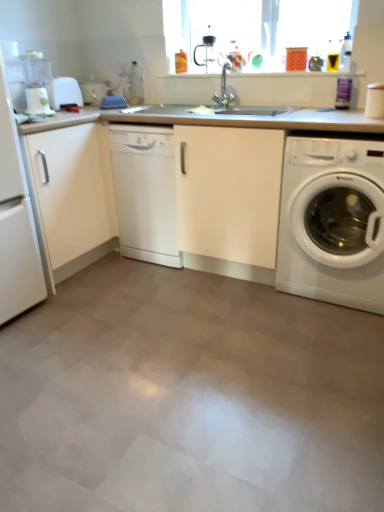
Question: Is matte white toaster at upper left, the first appliance positioned from the back, bigger than white glossy dishwasher at center?

Choices:
 (A) no
 (B) yes

Answer: (A)

Question: Is matte white toaster at upper left, the first appliance positioned from the back, aimed at white glossy dishwasher at center?

Choices:
 (A) yes
 (B) no

Answer: (B)

Question: Can you confirm if matte white toaster at upper left, the first appliance positioned from the back, is positioned to the left of white glossy dishwasher at center?

Choices:
 (A) yes
 (B) no

Answer: (A)

Question: Is matte white toaster at upper left, the first appliance positioned from the back, facing away from white glossy dishwasher at center?

Choices:
 (A) no
 (B) yes

Answer: (A)

Question: From the image's perspective, is matte white toaster at upper left, the first appliance positioned from the back, located beneath white glossy dishwasher at center?

Choices:
 (A) yes
 (B) no

Answer: (B)

Question: Is there a large distance between matte white toaster at upper left, the first appliance positioned from the back, and white glossy dishwasher at center?

Choices:
 (A) yes
 (B) no

Answer: (B)

Question: Considering the relative sizes of matte white toaster at upper left, placed as the second appliance when sorted from front to back, and white plastic coffee machine at left in the image provided, is matte white toaster at upper left, placed as the second appliance when sorted from front to back, wider than white plastic coffee machine at left?

Choices:
 (A) no
 (B) yes

Answer: (B)

Question: Is matte white toaster at upper left, placed as the second appliance when sorted from front to back, outside white plastic coffee machine at left?

Choices:
 (A) yes
 (B) no

Answer: (A)

Question: Is matte white toaster at upper left, the first appliance positioned from the back, taller than white plastic coffee machine at left?

Choices:
 (A) yes
 (B) no

Answer: (B)

Question: Considering the relative sizes of matte white toaster at upper left, the first appliance positioned from the back, and white plastic coffee machine at left in the image provided, is matte white toaster at upper left, the first appliance positioned from the back, smaller than white plastic coffee machine at left?

Choices:
 (A) yes
 (B) no

Answer: (B)

Question: Are matte white toaster at upper left, placed as the second appliance when sorted from front to back, and white plastic coffee machine at left making contact?

Choices:
 (A) no
 (B) yes

Answer: (A)

Question: Considering the relative positions of matte white toaster at upper left, the first appliance positioned from the back, and white plastic coffee machine at left in the image provided, is matte white toaster at upper left, the first appliance positioned from the back, in front of white plastic coffee machine at left?

Choices:
 (A) no
 (B) yes

Answer: (A)

Question: Is white matte countertop at center in front of white matte cabinet at left?

Choices:
 (A) no
 (B) yes

Answer: (B)